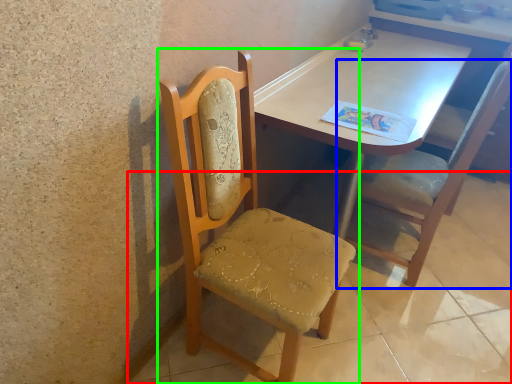
Question: Which object is positioned closest to concrete (highlighted by a red box)? Select from chair (highlighted by a blue box) and chair (highlighted by a green box).

Choices:
 (A) chair
 (B) chair

Answer: (A)